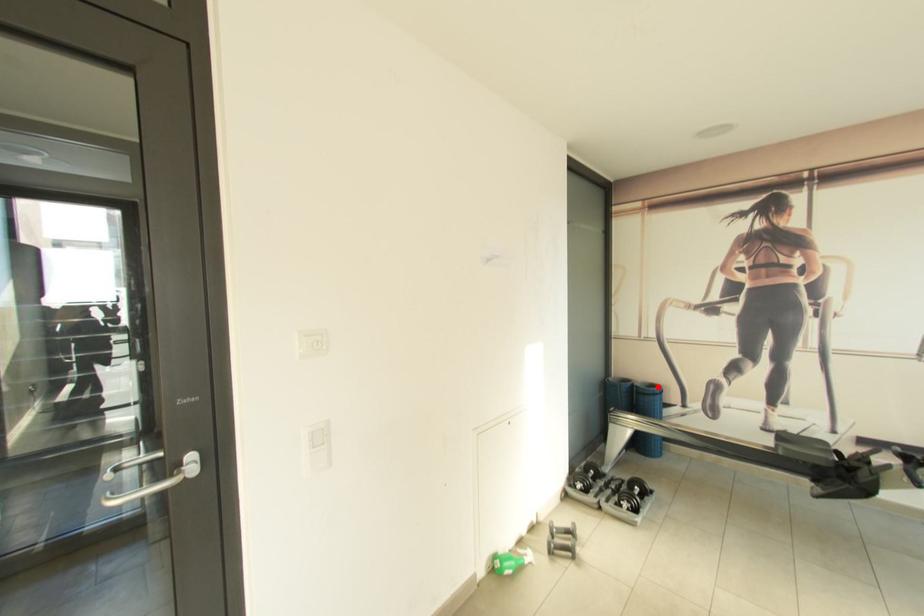
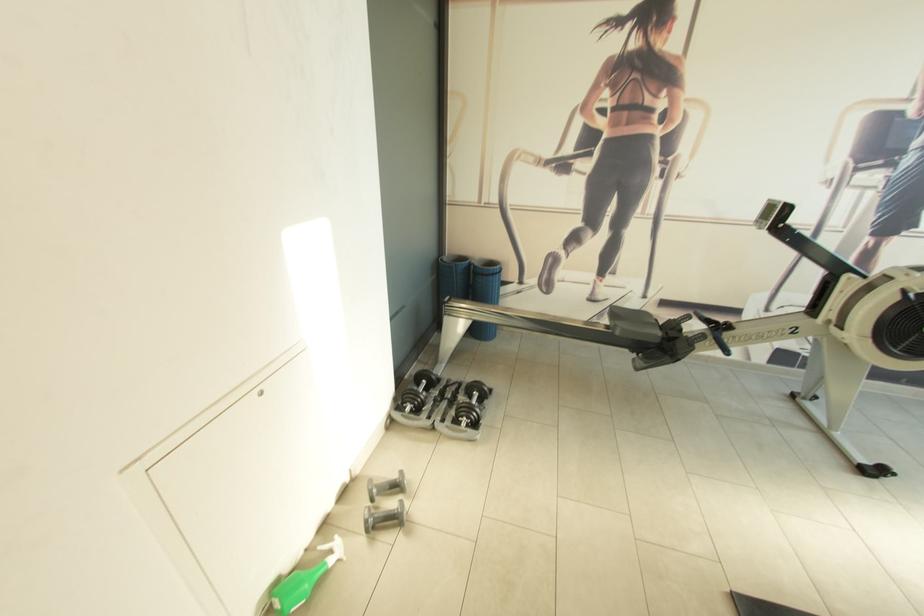
Where in the second image is the point corresponding to the highlighted location from the first image?

(497, 265)